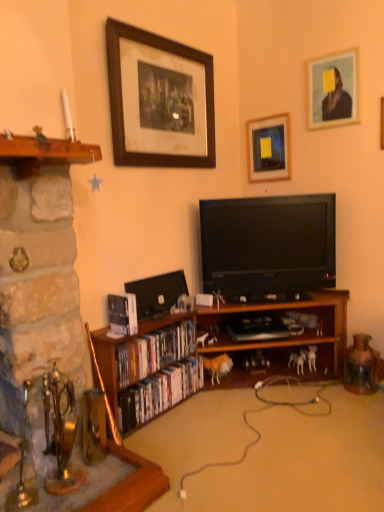
What is the approximate height of matte black picture frame at upper center, placed as the second picture frame when sorted from right to left?

17.56 inches.

The image size is (384, 512). Describe the element at coordinates (277, 336) in the screenshot. I see `wooden bookshelf at center` at that location.

How much space does matte plastic dvds at lower left, placed as the first book when sorted from bottom to top, occupy horizontally?

matte plastic dvds at lower left, placed as the first book when sorted from bottom to top, is 5.27 inches in width.

The height and width of the screenshot is (512, 384). In order to click on stone fireplace at left in this screenshot , I will do `click(39, 258)`.

What is the approximate width of wooden picture frame at upper right, the third picture frame from the left?

wooden picture frame at upper right, the third picture frame from the left, is 1.34 inches in width.

Describe the element at coordinates (123, 314) in the screenshot. Image resolution: width=384 pixels, height=512 pixels. I see `hardcover book at lower left, the 3th book ordered from the bottom` at that location.

Locate an element on the screen. rusty metal jug at lower right is located at coordinates tap(360, 366).

Which object is thinner, stone fireplace at left or black glossy flat-screen tv at center?

With smaller width is black glossy flat-screen tv at center.

Would you say black glossy flat-screen tv at center is part of stone fireplace at left's contents?

No, black glossy flat-screen tv at center is not inside stone fireplace at left.

From a real-world perspective, which is physically above, stone fireplace at left or black glossy flat-screen tv at center?

In real-world perspective, black glossy flat-screen tv at center is above.

From the image's perspective, which object appears higher, stone fireplace at left or black glossy flat-screen tv at center?

black glossy flat-screen tv at center appears higher in the image.

Is matte black picture frame at upper center, placed as the second picture frame when sorted from right to left, bigger than black glossy flat-screen tv at center?

Incorrect, matte black picture frame at upper center, placed as the second picture frame when sorted from right to left, is not larger than black glossy flat-screen tv at center.

Measure the distance between matte black picture frame at upper center, placed as the second picture frame when sorted from right to left, and black glossy flat-screen tv at center.

22.95 inches.

Consider the image. Who is taller, matte black picture frame at upper center, marked as the 2th picture frame in a left-to-right arrangement, or black glossy flat-screen tv at center?

black glossy flat-screen tv at center.

Can you tell me how much matte black picture frame at upper center, placed as the second picture frame when sorted from right to left, and black glossy flat-screen tv at center differ in facing direction?

There is a 40.1-degree angle between the facing directions of matte black picture frame at upper center, placed as the second picture frame when sorted from right to left, and black glossy flat-screen tv at center.

Consider the image. From the image's perspective, is black glossy flat-screen tv at center above or below brown fur figurine at lower center, which ranks as the second animal in right-to-left order?

black glossy flat-screen tv at center is above brown fur figurine at lower center, which ranks as the second animal in right-to-left order.

Does black glossy flat-screen tv at center contain brown fur figurine at lower center, the 1th animal positioned from the left?

No, black glossy flat-screen tv at center does not contain brown fur figurine at lower center, the 1th animal positioned from the left.

Considering the positions of objects black glossy flat-screen tv at center and brown fur figurine at lower center, which ranks as the second animal in right-to-left order, in the image provided, who is behind, black glossy flat-screen tv at center or brown fur figurine at lower center, which ranks as the second animal in right-to-left order,?

Positioned behind is brown fur figurine at lower center, which ranks as the second animal in right-to-left order.

Does black glossy flat-screen tv at center have a greater width compared to brown fur figurine at lower center, which ranks as the second animal in right-to-left order?

Indeed, black glossy flat-screen tv at center has a greater width compared to brown fur figurine at lower center, which ranks as the second animal in right-to-left order.

Which object is closer to the camera taking this photo, wooden dvd case at lower left, which is the 2th book from bottom to top, or rusty metal jug at lower right?

wooden dvd case at lower left, which is the 2th book from bottom to top.

Is wooden dvd case at lower left, which is the 2th book from bottom to top, beside rusty metal jug at lower right?

No, wooden dvd case at lower left, which is the 2th book from bottom to top, is not beside rusty metal jug at lower right.

Considering the relative sizes of wooden dvd case at lower left, which is the 2th book from bottom to top, and rusty metal jug at lower right in the image provided, is wooden dvd case at lower left, which is the 2th book from bottom to top, taller than rusty metal jug at lower right?

No.

Is stone fireplace at left touching hardcover book at lower left, which is the first book in top-to-bottom order?

stone fireplace at left is not next to hardcover book at lower left, which is the first book in top-to-bottom order, and they're not touching.

Between stone fireplace at left and hardcover book at lower left, which is the first book in top-to-bottom order, which one appears on the right side from the viewer's perspective?

Positioned to the right is hardcover book at lower left, which is the first book in top-to-bottom order.

Can you confirm if stone fireplace at left is thinner than hardcover book at lower left, which is the first book in top-to-bottom order?

Incorrect, the width of stone fireplace at left is not less than that of hardcover book at lower left, which is the first book in top-to-bottom order.

Can you confirm if wooden bookshelf at center is smaller than hardcover book at lower left, which is the first book in top-to-bottom order?

Incorrect, wooden bookshelf at center is not smaller in size than hardcover book at lower left, which is the first book in top-to-bottom order.

Measure the distance between wooden bookshelf at center and hardcover book at lower left, the 3th book ordered from the bottom.

wooden bookshelf at center and hardcover book at lower left, the 3th book ordered from the bottom, are 56.44 centimeters apart from each other.

From a real-world perspective, who is located lower, wooden bookshelf at center or hardcover book at lower left, the 3th book ordered from the bottom?

wooden bookshelf at center is physically lower.

Is rusty metal jug at lower right bigger or smaller than wooden dvd case at lower left, the 2th book from the top?

In the image, rusty metal jug at lower right appears to be smaller than wooden dvd case at lower left, the 2th book from the top.

Looking at this image, does rusty metal jug at lower right turn towards wooden dvd case at lower left, which is the 2th book from bottom to top?

No, rusty metal jug at lower right is not aimed at wooden dvd case at lower left, which is the 2th book from bottom to top.

Which is closer, (369, 338) or (176, 350)?

Point (369, 338).

In the image, there is a stone fireplace at left. At what (x,y) coordinates should I click in order to perform the action: click on television above it (from the image's perspective). Please return your answer as a coordinate pair (x, y). This screenshot has height=512, width=384. Looking at the image, I should click on (268, 246).

What are the coordinates of `television below the matte black picture frame at upper center, placed as the second picture frame when sorted from right to left (from the image's perspective)` in the screenshot? It's located at (268, 246).

Consider the image. Considering their positions, is wooden dvd case at lower left, which is the 2th book from bottom to top, positioned further to white plastic dog at lower right, the first animal positioned from the right, than hardcover book at lower left, which is the first book in top-to-bottom order?

hardcover book at lower left, which is the first book in top-to-bottom order, lies further to white plastic dog at lower right, the first animal positioned from the right, than the other object.

Considering their positions, is rusty metal jug at lower right positioned further to matte plastic dvds at lower left, placed as the first book when sorted from bottom to top, than wooden framed print at upper center, acting as the 1th picture frame starting from the left?

Among the two, wooden framed print at upper center, acting as the 1th picture frame starting from the left, is located further to matte plastic dvds at lower left, placed as the first book when sorted from bottom to top.

When comparing their distances from wooden dvd case at lower left, which is the 2th book from bottom to top, does wooden framed print at upper center, the 3th picture frame in the right-to-left sequence, or white plastic dog at lower right, the first animal positioned from the right, seem closer?

white plastic dog at lower right, the first animal positioned from the right, is positioned closer to the anchor wooden dvd case at lower left, which is the 2th book from bottom to top.

From the picture: Based on their spatial positions, is wooden dvd case at lower left, which is the 2th book from bottom to top, or black glossy flat-screen tv at center further from rusty metal jug at lower right?

wooden dvd case at lower left, which is the 2th book from bottom to top, lies further to rusty metal jug at lower right than the other object.

When comparing their distances from rusty metal jug at lower right, does matte plastic dvds at lower left, marked as the third book in a top-to-bottom arrangement, or black glossy flat-screen tv at center seem further?

The object further to rusty metal jug at lower right is matte plastic dvds at lower left, marked as the third book in a top-to-bottom arrangement.

Estimate the real-world distances between objects in this image. Which object is closer to wooden dvd case at lower left, which is the 2th book from bottom to top, hardcover book at lower left, the 3th book ordered from the bottom, or black glossy flat-screen tv at center?

Among the two, hardcover book at lower left, the 3th book ordered from the bottom, is located nearer to wooden dvd case at lower left, which is the 2th book from bottom to top.

Based on their spatial positions, is matte black picture frame at upper center, placed as the second picture frame when sorted from right to left, or matte plastic dvds at lower left, marked as the third book in a top-to-bottom arrangement, closer to black glossy flat-screen tv at center?

matte black picture frame at upper center, placed as the second picture frame when sorted from right to left.

Considering their positions, is wooden bookshelf at center positioned closer to white plastic dog at lower right, marked as the 2th animal in a left-to-right arrangement, than hardcover book at lower left, which is the first book in top-to-bottom order?

The object closer to white plastic dog at lower right, marked as the 2th animal in a left-to-right arrangement, is wooden bookshelf at center.

The width and height of the screenshot is (384, 512). Find the location of `picture frame between wooden framed print at upper center, acting as the 1th picture frame starting from the left, and black glossy flat-screen tv at center in the up-down direction`. picture frame between wooden framed print at upper center, acting as the 1th picture frame starting from the left, and black glossy flat-screen tv at center in the up-down direction is located at coordinates [x=269, y=148].

Find the location of `bookcase between wooden framed print at upper center, acting as the 1th picture frame starting from the left, and matte plastic dvds at lower left, placed as the first book when sorted from bottom to top, in the up-down direction`. bookcase between wooden framed print at upper center, acting as the 1th picture frame starting from the left, and matte plastic dvds at lower left, placed as the first book when sorted from bottom to top, in the up-down direction is located at coordinates (277, 336).

This screenshot has height=512, width=384. I want to click on television that lies between matte black picture frame at upper center, marked as the 2th picture frame in a left-to-right arrangement, and rusty metal jug at lower right from top to bottom, so click(x=268, y=246).

Identify the location of television between stone fireplace at left and brown fur figurine at lower center, the 1th animal positioned from the left, in the front-back direction. The width and height of the screenshot is (384, 512). (268, 246).